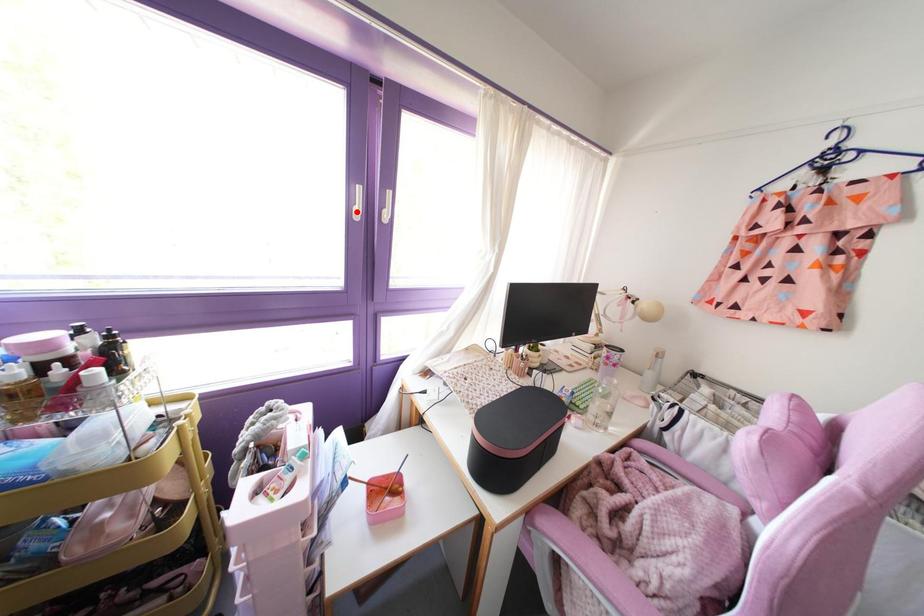
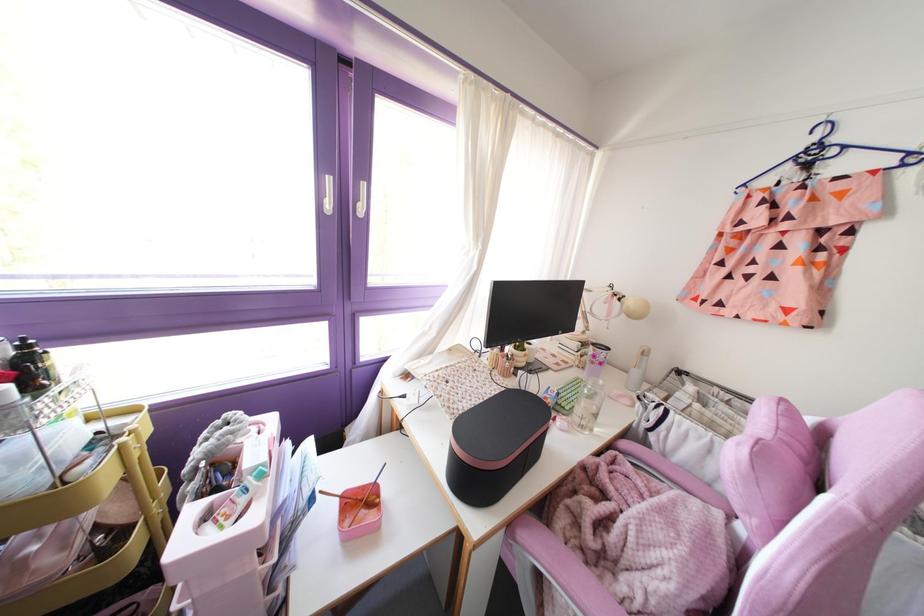
Find the pixel in the second image that matches the highlighted location in the first image.

(329, 205)